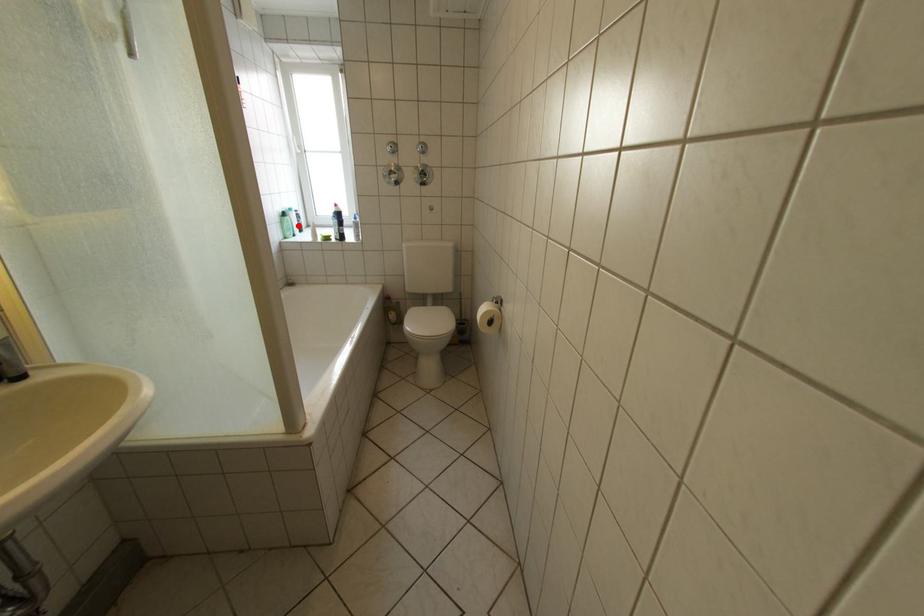
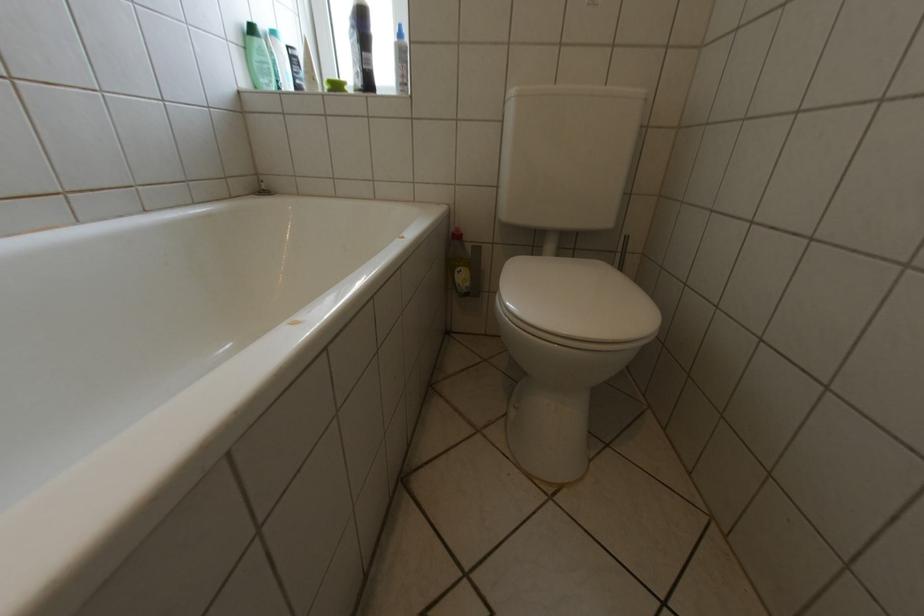
The point at the highlighted location is marked in the first image. Where is the corresponding point in the second image?

(268, 59)